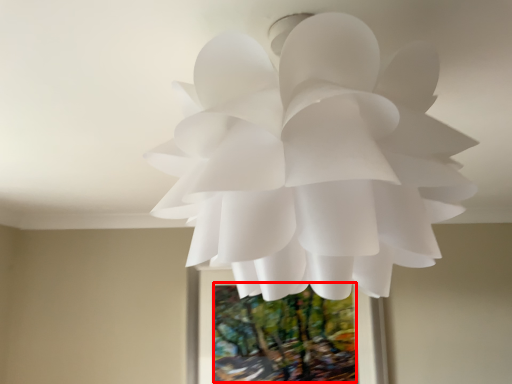
Question: From the image, what is the correct spatial relationship of tree (annotated by the red box) in relation to flower?

Choices:
 (A) right
 (B) left

Answer: (A)